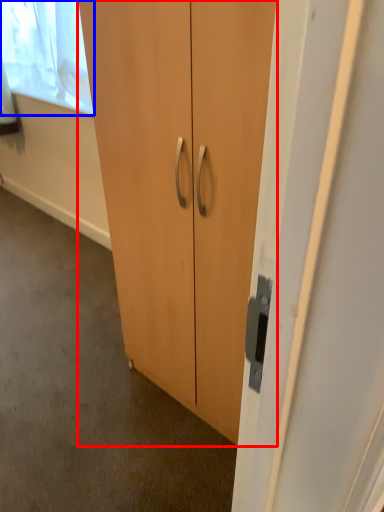
Question: Among these objects, which one is nearest to the camera, cupboard (highlighted by a red box) or window screen (highlighted by a blue box)?

Choices:
 (A) cupboard
 (B) window screen

Answer: (A)